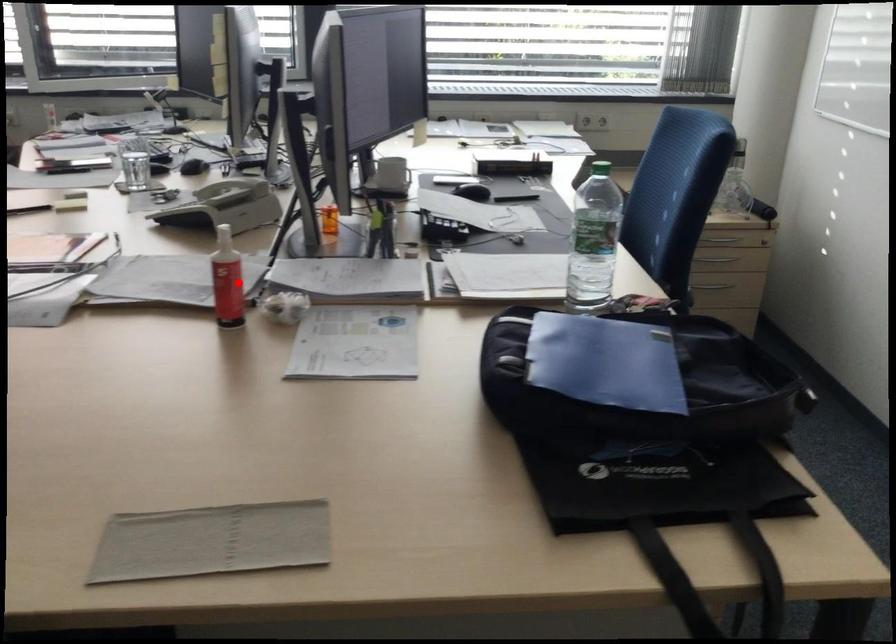
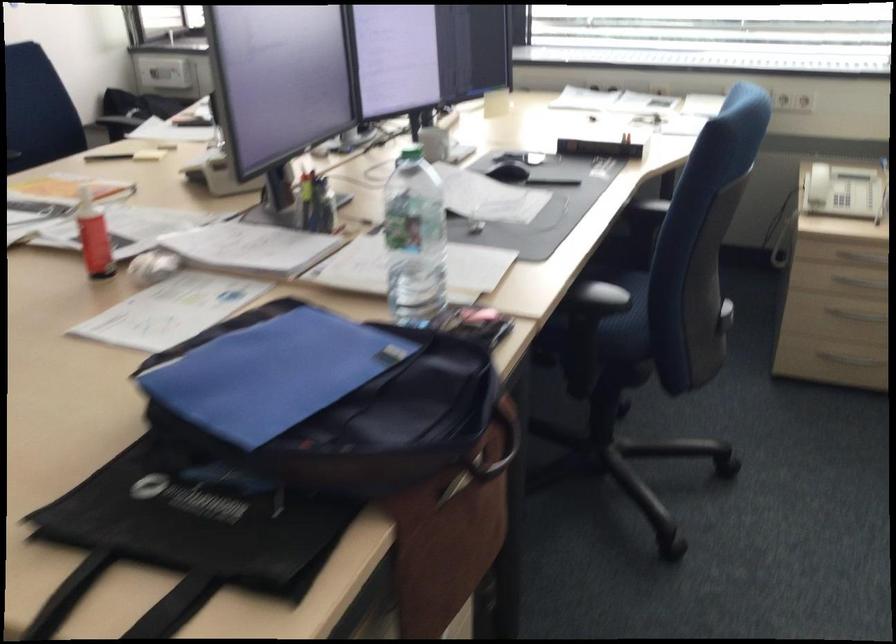
Question: I am providing you with two images of the same scene from different viewpoints. A red point is marked on the first image. Can you still see the location of the red point in image 2?

Choices:
 (A) Yes
 (B) No

Answer: (A)